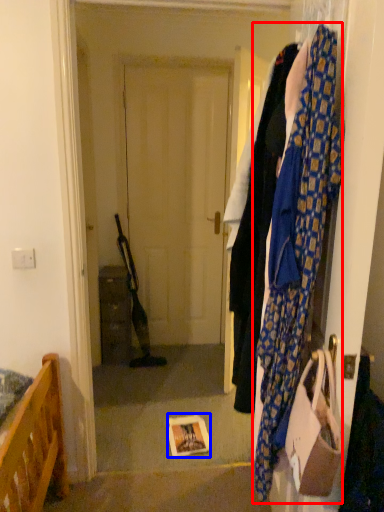
Question: Which of the following is the closest to the observer, scarf (highlighted by a red box) or book (highlighted by a blue box)?

Choices:
 (A) scarf
 (B) book

Answer: (A)